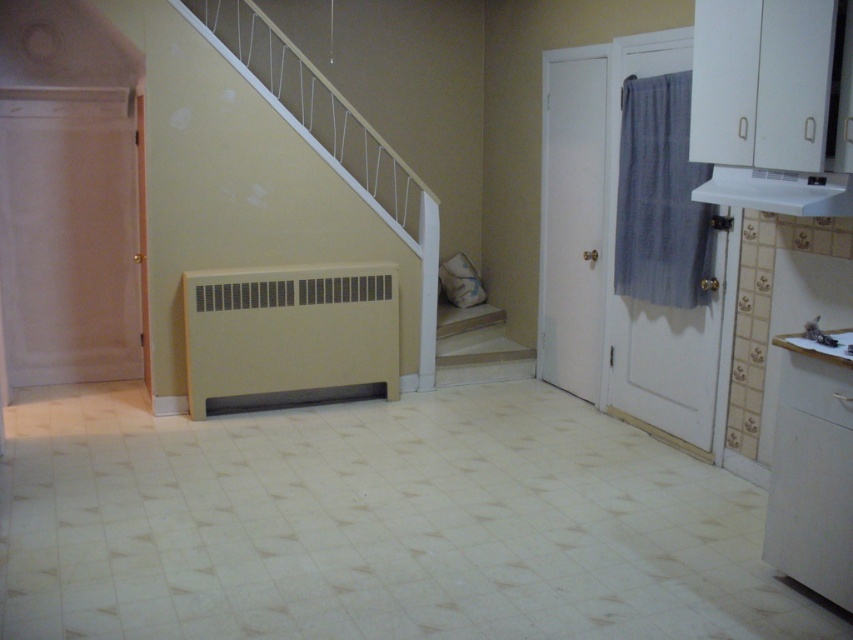
Question: Can you confirm if white matte dishwasher at lower right is smaller than wooden staircase at center?

Choices:
 (A) no
 (B) yes

Answer: (B)

Question: Among these points, which one is farthest from the camera?

Choices:
 (A) (444, 307)
 (B) (225, 316)

Answer: (A)

Question: Which point appears closest to the camera in this image?

Choices:
 (A) (830, 524)
 (B) (283, 282)
 (C) (454, 369)

Answer: (A)

Question: Observing the image, what is the correct spatial positioning of beige matte radiator at lower center in reference to wooden staircase at center?

Choices:
 (A) below
 (B) above

Answer: (B)

Question: Among these points, which one is nearest to the camera?

Choices:
 (A) (824, 516)
 (B) (445, 326)
 (C) (227, 369)

Answer: (A)

Question: Can you confirm if beige matte radiator at lower center is positioned above white matte dishwasher at lower right?

Choices:
 (A) yes
 (B) no

Answer: (A)